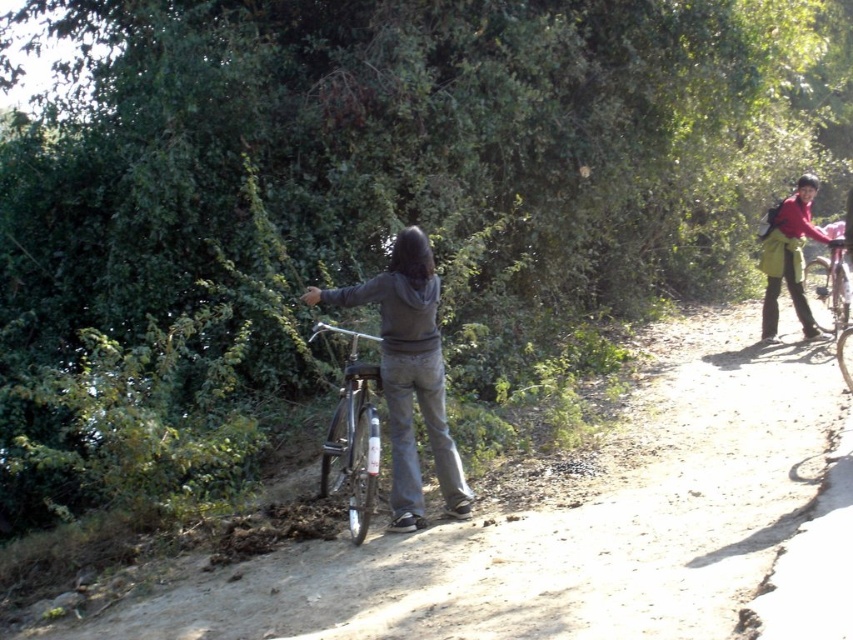
Question: Does shiny metallic bicycle at center have a smaller size compared to red fabric backpack at upper right?

Choices:
 (A) yes
 (B) no

Answer: (A)

Question: Which object appears farthest from the camera in this image?

Choices:
 (A) red fabric backpack at upper right
 (B) matte black bicycle at center
 (C) shiny metallic bicycle at center

Answer: (A)

Question: Does matte black bicycle at center have a smaller size compared to red fabric backpack at upper right?

Choices:
 (A) yes
 (B) no

Answer: (A)

Question: Is matte black bicycle at center positioned at the back of red fabric backpack at upper right?

Choices:
 (A) yes
 (B) no

Answer: (B)

Question: Considering the real-world distances, which object is farthest from the matte black bicycle at center?

Choices:
 (A) shiny metallic bicycle at center
 (B) red fabric backpack at upper right

Answer: (B)

Question: Based on their relative distances, which object is nearer to the shiny metallic bicycle at center?

Choices:
 (A) matte black bicycle at center
 (B) red fabric backpack at upper right

Answer: (A)